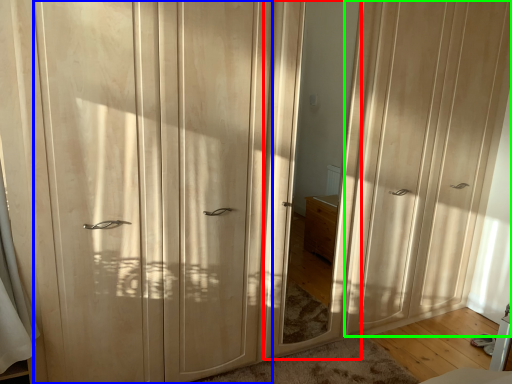
Question: Which is nearer to the mirror (highlighted by a red box)? screen door (highlighted by a blue box) or screen door (highlighted by a green box).

Choices:
 (A) screen door
 (B) screen door

Answer: (B)